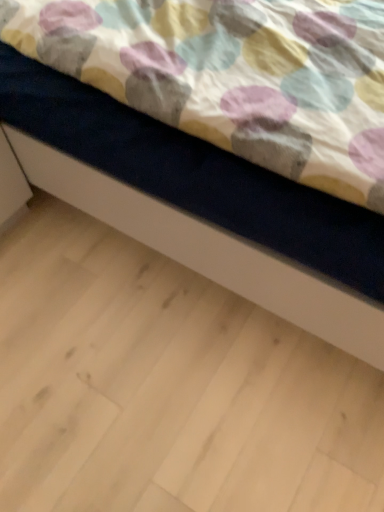
Describe the element at coordinates (233, 76) in the screenshot. The width and height of the screenshot is (384, 512). I see `navy blue fabric bed at upper center` at that location.

In the scene shown: Measure the distance between point (45, 165) and camera.

Point (45, 165) is 3.37 feet away from camera.

This screenshot has height=512, width=384. Find the location of `navy blue fabric bed at upper center`. navy blue fabric bed at upper center is located at coordinates (233, 76).

Locate an element on the screen. The image size is (384, 512). navy blue fabric bed at upper center is located at coordinates (233, 76).